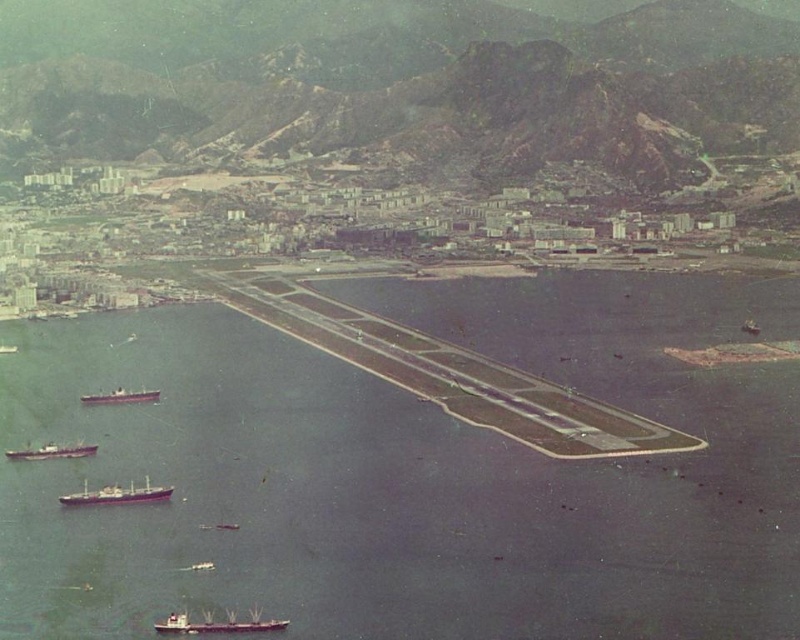
Image resolution: width=800 pixels, height=640 pixels. What do you see at coordinates (218, 624) in the screenshot? I see `metallic gray cargo ship at lower center` at bounding box center [218, 624].

This screenshot has width=800, height=640. Describe the element at coordinates (218, 624) in the screenshot. I see `metallic gray cargo ship at lower center` at that location.

This screenshot has width=800, height=640. Identify the location of metallic gray cargo ship at lower center. (218, 624).

Measure the distance from blue water at center to metallic gray ship at lower left.

blue water at center is 99.28 meters from metallic gray ship at lower left.

Is blue water at center closer to the viewer compared to metallic gray ship at lower left?

Yes, it is.

Where is `blue water at center`? The height and width of the screenshot is (640, 800). blue water at center is located at coordinates (410, 472).

The height and width of the screenshot is (640, 800). What are the coordinates of `metallic gray cargo ship at lower center` in the screenshot? It's located at (218, 624).

Is metallic gray cargo ship at lower center above brown matte ship at lower left?

No, metallic gray cargo ship at lower center is not above brown matte ship at lower left.

Which is behind, point (182, 616) or point (54, 449)?

Positioned behind is point (182, 616).

The image size is (800, 640). I want to click on metallic gray cargo ship at lower center, so click(218, 624).